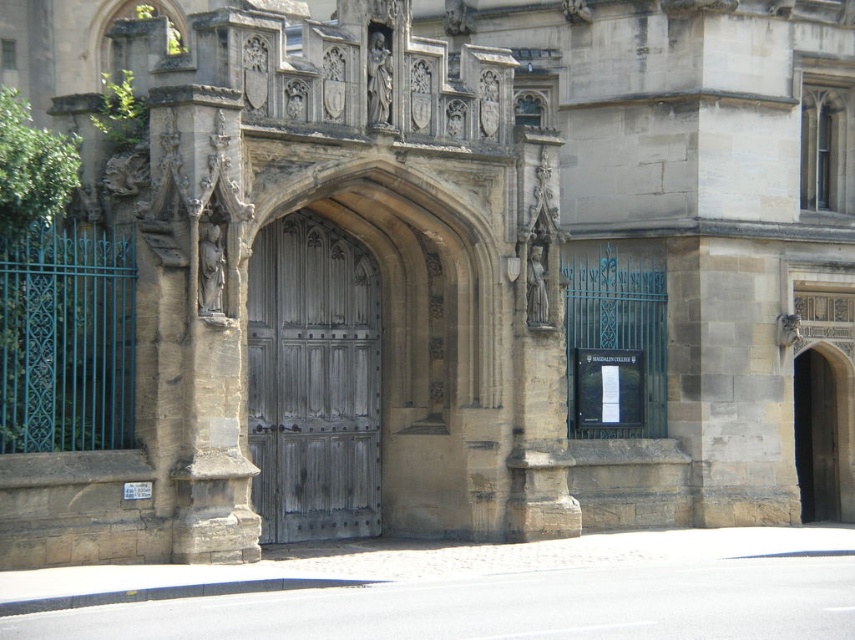
You are a maintenance worker tasked with replacing the door at the historic building. You have two doors available for installation. One is the wooden carved door at center and the other is the weathered wood door at center. Based on their sizes, which door should you choose to ensure it fits properly in the doorway?

The wooden carved door at center has a larger size compared to the weathered wood door at center. Therefore, you should choose the wooden carved door at center to ensure it fits properly in the doorway.

You are standing in front of the historic building and want to enter through the wooden carved door at center. Based on its position, can you estimate whether the door is centrally aligned with the arched doorway?

The wooden carved door at center is located at point coordinates that are not provided in the scene description. However, according to the scene description, the door is at the center of the image, which typically corresponds to the central axis of the doorway. Therefore, it is likely centrally aligned with the arched doorway.

You are a maintenance worker inspecting the historic building. You notice two doors at the center of the structure. Which door should you prioritize checking for structural issues first, the wooden carved door at center or the weathered wood door at center?

The wooden carved door at center is positioned over the weathered wood door at center, so you should prioritize checking the weathered wood door at center first since it is lower and more accessible.